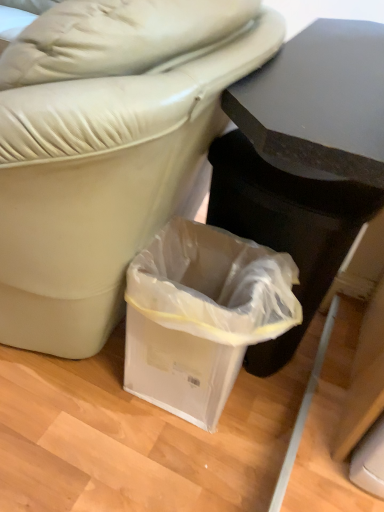
Question: Does point (175, 282) appear closer or farther from the camera than point (329, 29)?

Choices:
 (A) closer
 (B) farther

Answer: (A)

Question: In terms of width, does translucent plastic bag at lower center look wider or thinner when compared to black matte table at upper right?

Choices:
 (A) wide
 (B) thin

Answer: (B)

Question: Is translucent plastic bag at lower center taller or shorter than black matte table at upper right?

Choices:
 (A) tall
 (B) short

Answer: (B)

Question: In the image, is black matte table at upper right positioned in front of or behind translucent plastic bag at lower center?

Choices:
 (A) front
 (B) behind

Answer: (A)

Question: From a real-world perspective, relative to translucent plastic bag at lower center, is black matte table at upper right vertically above or below?

Choices:
 (A) below
 (B) above

Answer: (B)

Question: Considering the positions of black matte table at upper right and translucent plastic bag at lower center in the image, is black matte table at upper right taller or shorter than translucent plastic bag at lower center?

Choices:
 (A) short
 (B) tall

Answer: (B)

Question: Is point (329, 141) closer or farther from the camera than point (165, 305)?

Choices:
 (A) closer
 (B) farther

Answer: (A)